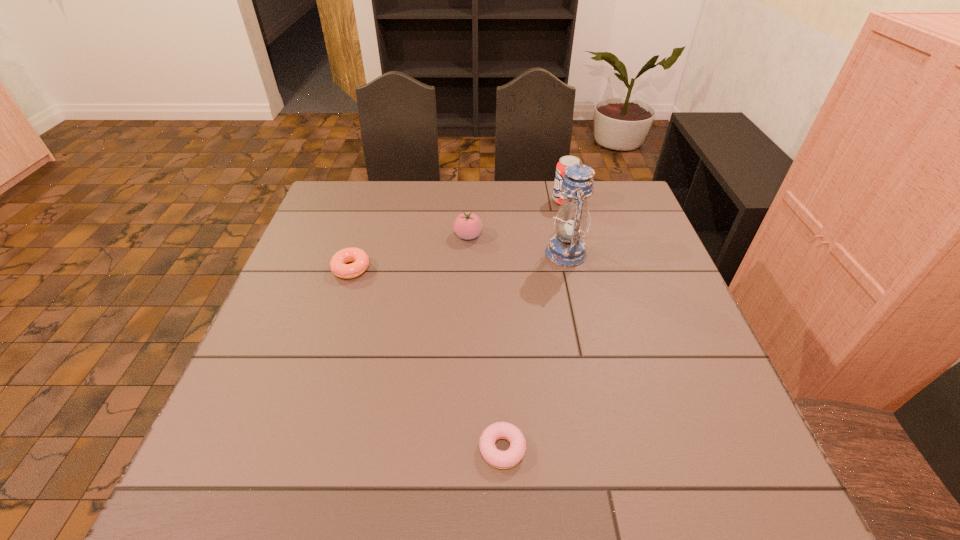
Find the location of a particular element. vacant space that is in between the fourth shortest object and the tomato is located at coordinates (516, 218).

The image size is (960, 540). I want to click on free spot between the left doughnut and the tallest object, so point(459,261).

You are a GUI agent. You are given a task and a screenshot of the screen. Output one action in this format:
    pyautogui.click(x=<x>, y=<y>)
    Task: Click on the free point between the shortest object and the left doughnut
    This screenshot has width=960, height=540.
    Given the screenshot: What is the action you would take?
    pyautogui.click(x=426, y=359)

The width and height of the screenshot is (960, 540). Find the location of `vacant space that's between the tomato and the second tallest object`. vacant space that's between the tomato and the second tallest object is located at coordinates (516, 218).

What are the coordinates of `free space that is in between the third shortest object and the second tallest object` in the screenshot? It's located at (516, 218).

The image size is (960, 540). Identify the location of vacant space in between the tallest object and the nearest object. (534, 351).

Identify which object is the third closest to the fourth tallest object. Please provide its 2D coordinates. Your answer should be formatted as a tuple, i.e. [(x, y)], where the tuple contains the x and y coordinates of a point satisfying the conditions above.

[(511, 457)]

Identify which object is the third closest to the farthest object. Please provide its 2D coordinates. Your answer should be formatted as a tuple, i.e. [(x, y)], where the tuple contains the x and y coordinates of a point satisfying the conditions above.

[(339, 267)]